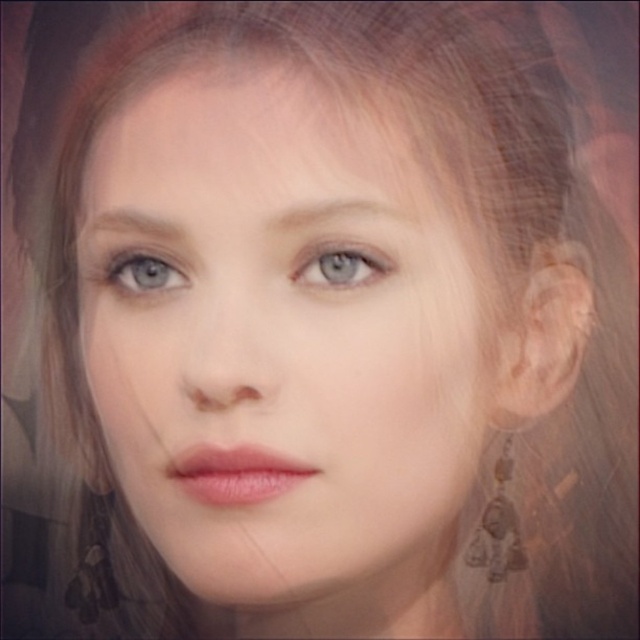
Question: Which object is the closest to the blue glossy eye at upper left?

Choices:
 (A) blue matte eye at center
 (B) gold textured earring at lower right

Answer: (A)

Question: Does smooth skin face at center have a greater width compared to blue glossy eye at upper left?

Choices:
 (A) no
 (B) yes

Answer: (B)

Question: Which of the following is the closest to the observer?

Choices:
 (A) (381, 276)
 (B) (502, 541)

Answer: (A)

Question: Can you confirm if smooth skin face at center is smaller than blue matte eye at center?

Choices:
 (A) yes
 (B) no

Answer: (B)

Question: Does smooth skin face at center appear over gold textured earring at lower right?

Choices:
 (A) yes
 (B) no

Answer: (A)

Question: Which point is closer to the camera?

Choices:
 (A) blue matte eye at center
 (B) gold textured earring at lower right
 (C) blue glossy eye at upper left
 (D) smooth skin face at center

Answer: (D)